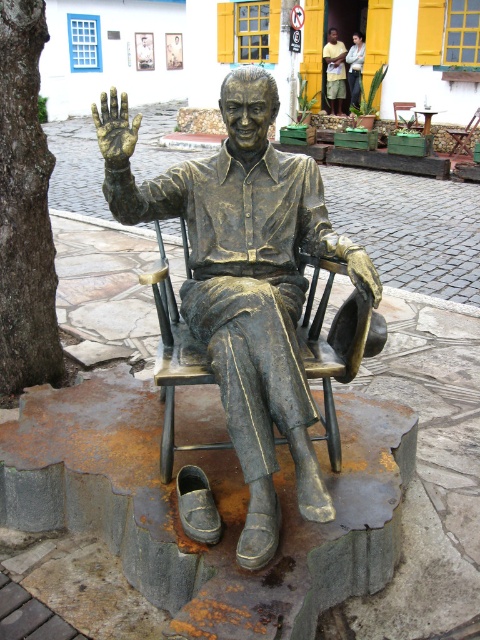
Based on the photo, you are a maintenance worker who needs to clean both the bronze textured rocking chair at center and the gold metallic hand at center. If your cleaning spray can only reach up to 3 feet, can you clean both objects without moving either of them?

The distance between the bronze textured rocking chair at center and the gold metallic hand at center is 3.41 feet, which is slightly beyond the 3 feet reach of the spray. Therefore, you will need to move at least one of the objects closer to clean them both effectively.

You are an artist planning to create a miniature replica of the statue. You have a limited space that can only accommodate objects up to the width of the gold metallic hand at center. Can the bronze textured rocking chair at center fit within this space?

The bronze textured rocking chair at center is wider than the gold metallic hand at center, so it cannot fit within the space allocated for the gold metallic hand at center.

You are a photographer standing at the camera position. You want to take a closeup shot of the bronze textured rocking chair at center. What is the minimum distance you need to move towards the chair to ensure it fills the frame properly?

The bronze textured rocking chair at center is 2.31 meters away from the camera. To take a closeup shot, you need to move closer to reduce the distance. The minimum distance required would depend on the camera lens specifications, but moving to within 1 meter might be necessary for a tight focus.